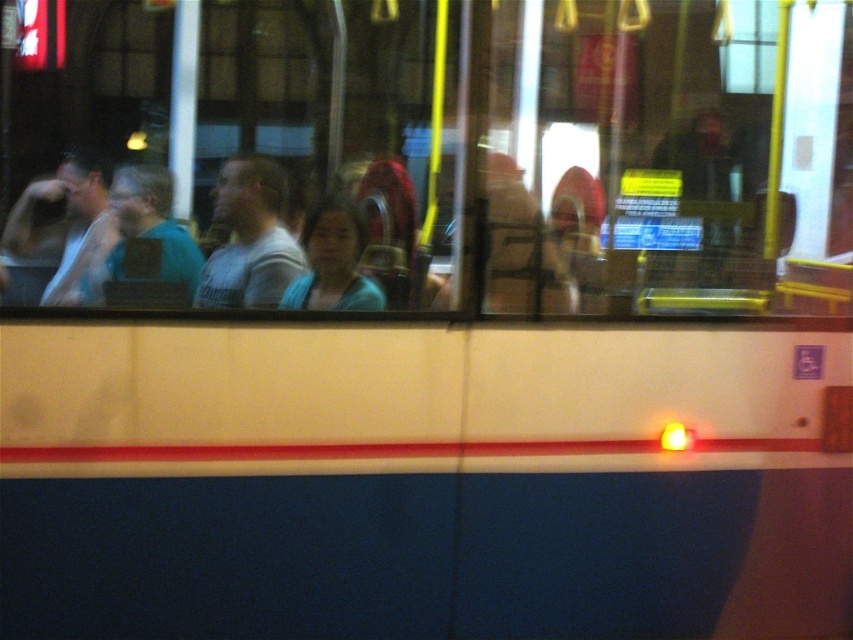
Does matte green shirt at left come behind matte blue shirt at center?

No, matte green shirt at left is in front of matte blue shirt at center.

Which is more to the right, matte green shirt at left or matte blue shirt at center?

From the viewer's perspective, matte blue shirt at center appears more on the right side.

Between point (128, 200) and point (363, 289), which one is positioned behind?

Positioned behind is point (363, 289).

What are the coordinates of `matte green shirt at left` in the screenshot? It's located at (148, 244).

Can you confirm if light blue shirt at center is smaller than white tank top at left?

Yes, light blue shirt at center is smaller than white tank top at left.

Is point (279, 228) more distant than point (85, 253)?

That is True.

The height and width of the screenshot is (640, 853). Find the location of `light blue shirt at center`. light blue shirt at center is located at coordinates (250, 237).

Can you confirm if white tank top at left is shorter than matte green shirt at left?

In fact, white tank top at left may be taller than matte green shirt at left.

Which is in front, point (70, 163) or point (149, 220)?

Point (70, 163) is more forward.

Image resolution: width=853 pixels, height=640 pixels. I want to click on white tank top at left, so click(67, 227).